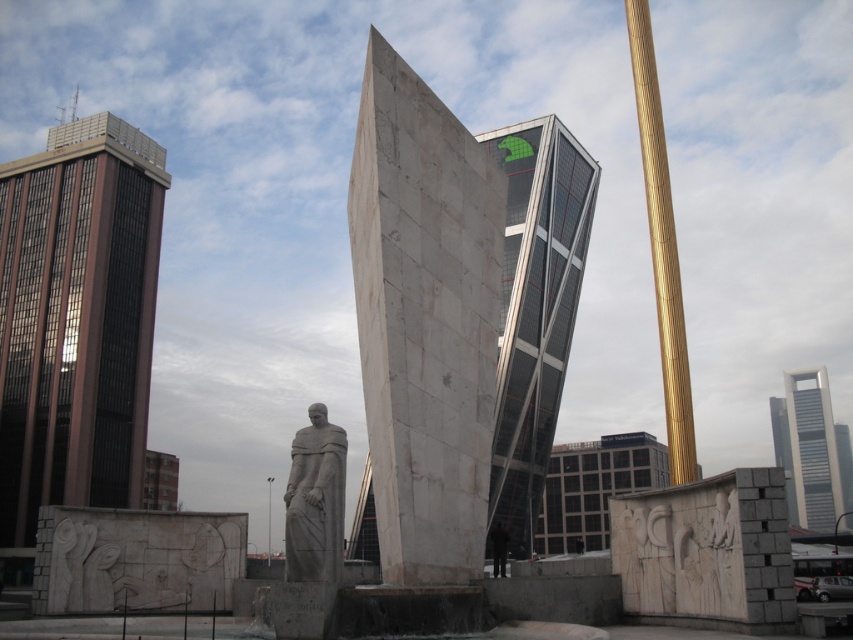
Which of these two, gray stone statue at center or smooth gray skyscraper at upper right, stands taller?

Standing taller between the two is smooth gray skyscraper at upper right.

Between point (316, 417) and point (792, 387), which one is positioned in front?

Point (316, 417) is more forward.

This screenshot has width=853, height=640. Identify the location of gray stone statue at center. (315, 500).

Can you confirm if gold polished pole at upper right is positioned to the right of dark gray concrete building at center?

In fact, gold polished pole at upper right is to the left of dark gray concrete building at center.

Is point (637, 108) positioned before point (589, 474)?

Yes, it is.

Does point (631, 44) come closer to viewer compared to point (601, 513)?

Yes, point (631, 44) is closer to viewer.

I want to click on gold polished pole at upper right, so click(662, 248).

Is glassy steel skyscraper at center to the left of dark gray concrete building at center from the viewer's perspective?

Correct, you'll find glassy steel skyscraper at center to the left of dark gray concrete building at center.

This screenshot has height=640, width=853. Describe the element at coordinates (535, 305) in the screenshot. I see `glassy steel skyscraper at center` at that location.

Is point (502, 369) more distant than point (650, 474)?

No, (502, 369) is closer to viewer.

Locate an element on the screen. The width and height of the screenshot is (853, 640). glassy steel skyscraper at center is located at coordinates (535, 305).